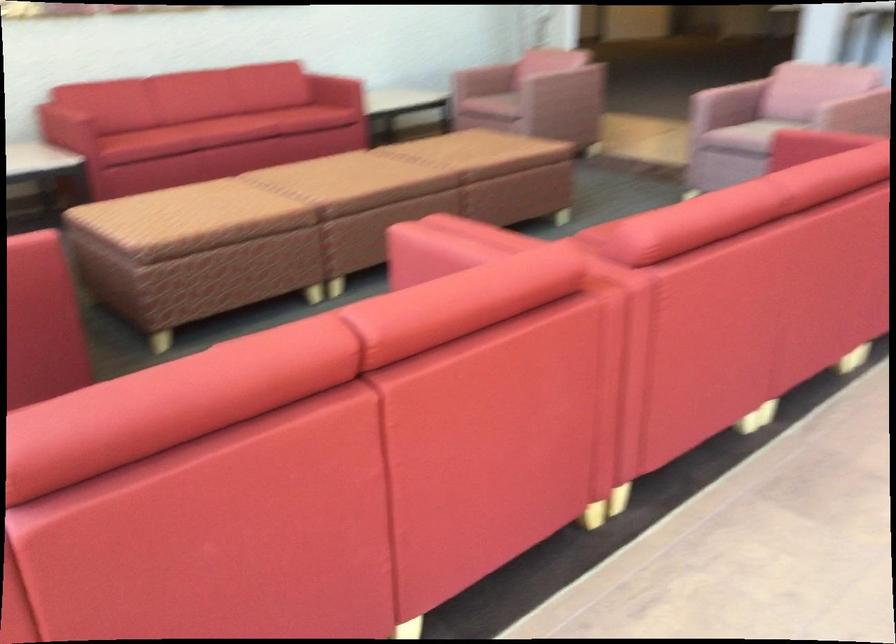
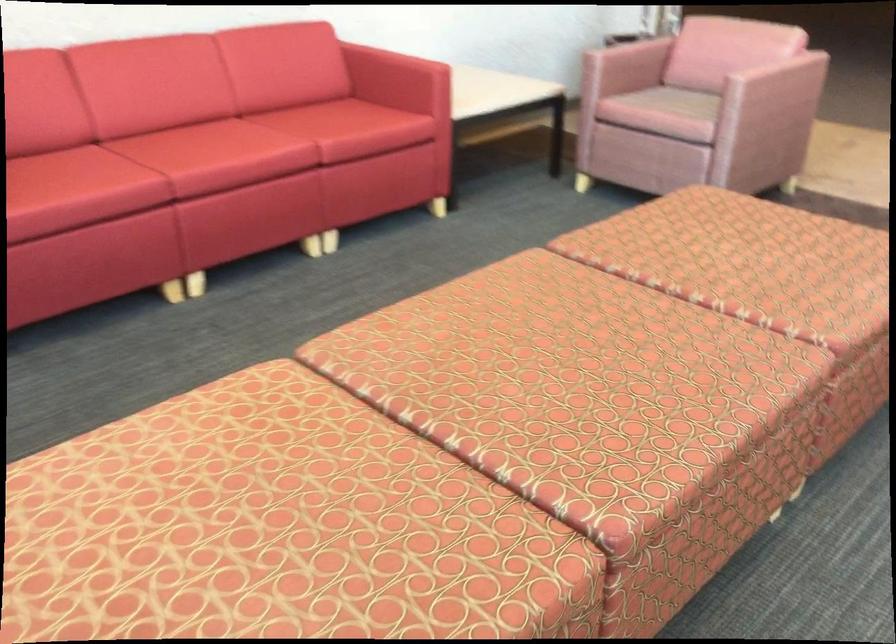
Locate, in the second image, the point that corresponds to the point at 213,120 in the first image.

(196, 144)